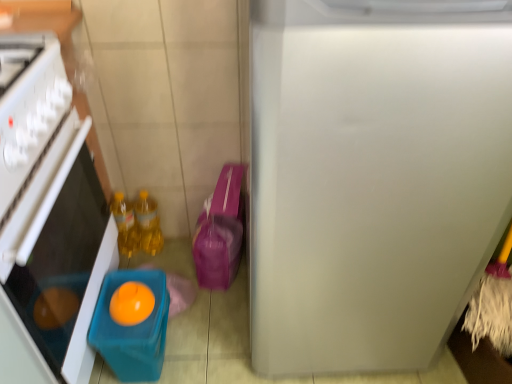
Question: Considering the relative positions of orange matte/orange at lower left and matte plastic container at lower left in the image provided, is orange matte/orange at lower left in front of matte plastic container at lower left?

Choices:
 (A) no
 (B) yes

Answer: (A)

Question: Is orange matte/orange at lower left not near matte plastic container at lower left?

Choices:
 (A) no
 (B) yes

Answer: (A)

Question: From the image's perspective, is orange matte/orange at lower left under matte plastic container at lower left?

Choices:
 (A) no
 (B) yes

Answer: (A)

Question: Can you confirm if orange matte/orange at lower left is shorter than matte plastic container at lower left?

Choices:
 (A) yes
 (B) no

Answer: (A)

Question: Considering the relative sizes of orange matte/orange at lower left and matte plastic container at lower left in the image provided, is orange matte/orange at lower left smaller than matte plastic container at lower left?

Choices:
 (A) yes
 (B) no

Answer: (A)

Question: Does orange matte/orange at lower left come behind matte plastic container at lower left?

Choices:
 (A) no
 (B) yes

Answer: (B)

Question: From a real-world perspective, is translucent plastic container at left on translucent yellow bottle at lower left, the second bottle when ordered from right to left?

Choices:
 (A) yes
 (B) no

Answer: (A)

Question: Would you consider translucent plastic container at left to be distant from translucent yellow bottle at lower left, the first bottle positioned from the left?

Choices:
 (A) no
 (B) yes

Answer: (A)

Question: From the image's perspective, is translucent plastic container at left under translucent yellow bottle at lower left, the first bottle positioned from the left?

Choices:
 (A) no
 (B) yes

Answer: (B)

Question: Is translucent plastic container at left surrounding translucent yellow bottle at lower left, the second bottle when ordered from right to left?

Choices:
 (A) yes
 (B) no

Answer: (B)

Question: Is translucent plastic container at left oriented towards translucent yellow bottle at lower left, the second bottle when ordered from right to left?

Choices:
 (A) no
 (B) yes

Answer: (A)

Question: Considering the relative positions of translucent plastic container at left and translucent yellow bottle at lower left, the second bottle when ordered from right to left, in the image provided, is translucent plastic container at left to the left of translucent yellow bottle at lower left, the second bottle when ordered from right to left, from the viewer's perspective?

Choices:
 (A) no
 (B) yes

Answer: (B)

Question: From the image's perspective, is matte plastic container at lower left beneath yellow translucent bottles at center, which is the 1th bottle in right-to-left order?

Choices:
 (A) yes
 (B) no

Answer: (A)